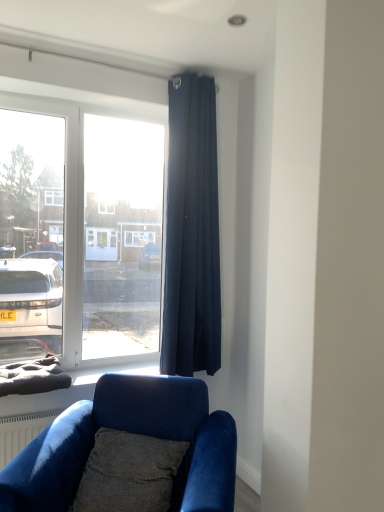
Question: From the image's perspective, is textured gray pillow at lower center on top of velvet blue couch at lower left?

Choices:
 (A) yes
 (B) no

Answer: (A)

Question: Is velvet blue couch at lower left inside textured gray pillow at lower center?

Choices:
 (A) yes
 (B) no

Answer: (B)

Question: Does textured gray pillow at lower center appear on the right side of velvet blue couch at lower left?

Choices:
 (A) no
 (B) yes

Answer: (B)

Question: Is textured gray pillow at lower center next to velvet blue couch at lower left?

Choices:
 (A) no
 (B) yes

Answer: (A)

Question: Is textured gray pillow at lower center bigger than velvet blue couch at lower left?

Choices:
 (A) no
 (B) yes

Answer: (A)

Question: Based on their sizes in the image, would you say textured gray pillow at lower center is bigger or smaller than velvet blue couch at lower left?

Choices:
 (A) big
 (B) small

Answer: (B)

Question: From a real-world perspective, is textured gray pillow at lower center positioned above or below velvet blue couch at lower left?

Choices:
 (A) below
 (B) above

Answer: (B)

Question: From the image's perspective, is textured gray pillow at lower center positioned above or below velvet blue couch at lower left?

Choices:
 (A) below
 (B) above

Answer: (B)

Question: In terms of width, does textured gray pillow at lower center look wider or thinner when compared to velvet blue couch at lower left?

Choices:
 (A) thin
 (B) wide

Answer: (A)

Question: Considering their positions, is velvet blue couch at lower left located in front of or behind textured gray pillow at lower center?

Choices:
 (A) front
 (B) behind

Answer: (A)

Question: Based on their positions, is velvet blue couch at lower left located to the left or right of textured gray pillow at lower center?

Choices:
 (A) left
 (B) right

Answer: (A)

Question: Is point (119, 414) closer or farther from the camera than point (173, 443)?

Choices:
 (A) farther
 (B) closer

Answer: (A)

Question: Is velvet blue couch at lower left bigger or smaller than textured gray pillow at lower center?

Choices:
 (A) small
 (B) big

Answer: (B)

Question: From the image's perspective, is textured gray pillow at lower center located above or below dark blue fabric curtain at upper right?

Choices:
 (A) below
 (B) above

Answer: (A)

Question: From a real-world perspective, relative to dark blue fabric curtain at upper right, is textured gray pillow at lower center vertically above or below?

Choices:
 (A) below
 (B) above

Answer: (A)